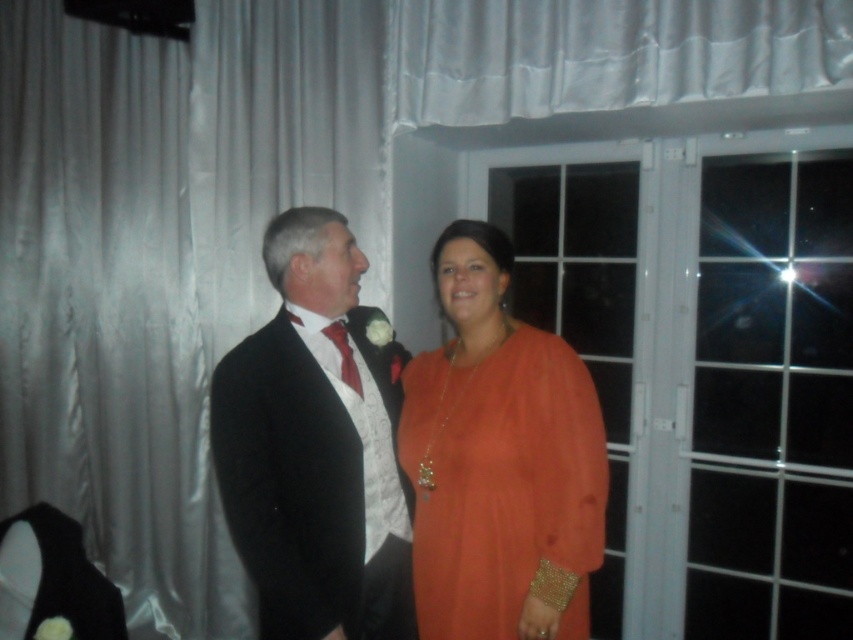
Question: Which of the following is the farthest from the observer?

Choices:
 (A) (328, 516)
 (B) (432, 384)
 (C) (132, 429)
 (D) (570, 96)

Answer: (C)

Question: Which point is closer to the camera taking this photo?

Choices:
 (A) (364, 509)
 (B) (643, 68)
 (C) (532, 561)

Answer: (C)

Question: In this image, where is orange satin dress at center located relative to satin white curtain at upper center?

Choices:
 (A) right
 (B) left

Answer: (B)

Question: Among these objects, which one is farthest from the camera?

Choices:
 (A) satin white curtain at upper center
 (B) orange satin dress at center

Answer: (A)

Question: Is orange satin dress at center to the left of satin white curtain at upper center from the viewer's perspective?

Choices:
 (A) no
 (B) yes

Answer: (B)

Question: In this image, where is silvery satin curtain at left located relative to satin white curtain at upper center?

Choices:
 (A) above
 (B) below

Answer: (B)